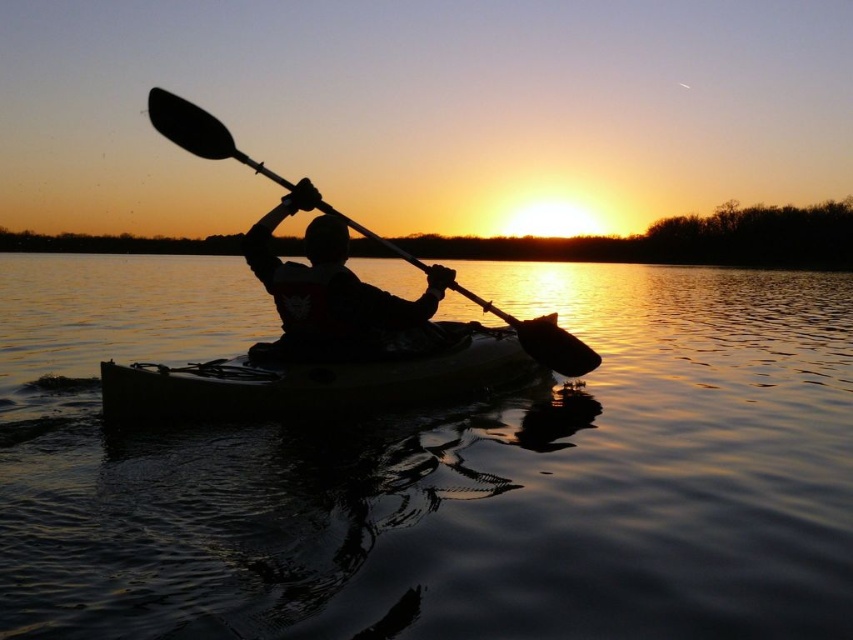
Question: Which of the following is the closest to the observer?

Choices:
 (A) (250, 163)
 (B) (335, 355)
 (C) (236, 376)
 (D) (746, 600)

Answer: (D)

Question: Observing the image, what is the correct spatial positioning of transparent water at center in reference to silhouette kayak at center?

Choices:
 (A) above
 (B) below

Answer: (A)

Question: Which of the following is the farthest from the observer?

Choices:
 (A) coord(204,404)
 (B) coord(750,460)
 (C) coord(215,132)

Answer: (B)

Question: Is yellow matte canoe at center positioned at the back of silhouette kayak at center?

Choices:
 (A) no
 (B) yes

Answer: (A)

Question: Can you confirm if transparent water at center is positioned below smooth black paddle at center?

Choices:
 (A) no
 (B) yes

Answer: (A)

Question: Estimate the real-world distances between objects in this image. Which object is closer to the transparent water at center?

Choices:
 (A) yellow matte canoe at center
 (B) smooth black paddle at center
 (C) silhouette kayak at center

Answer: (C)